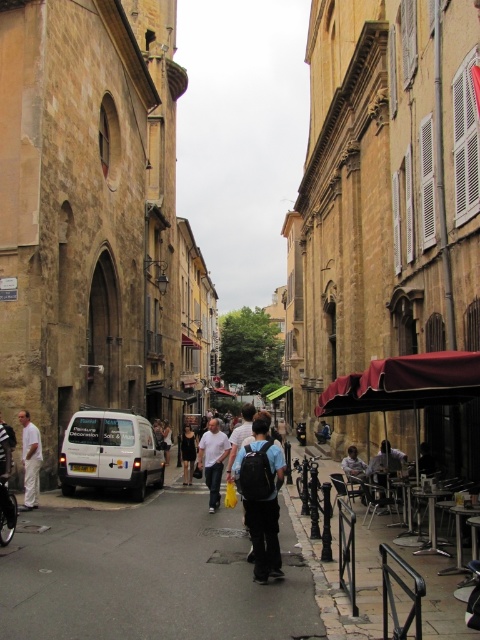
You are a delivery person trying to park your electric scooter. The scooter requires a minimum of 1 meter of space to park safely. Based on the image, can you determine if there is enough space on the gray asphalt pavement at center to park your scooter?

The gray asphalt pavement at center is located at point (146, 577) in 2D space. However, the provided information does not include the dimensions or available space on the pavement. Without knowing the size of the pavement, it is impossible to determine if there is enough space to park the scooter safely.

Consider the image. You are standing on the gray asphalt pavement at center. What are the coordinates of the point you are standing on?

The coordinates of the gray asphalt pavement at center are at point (146, 577).